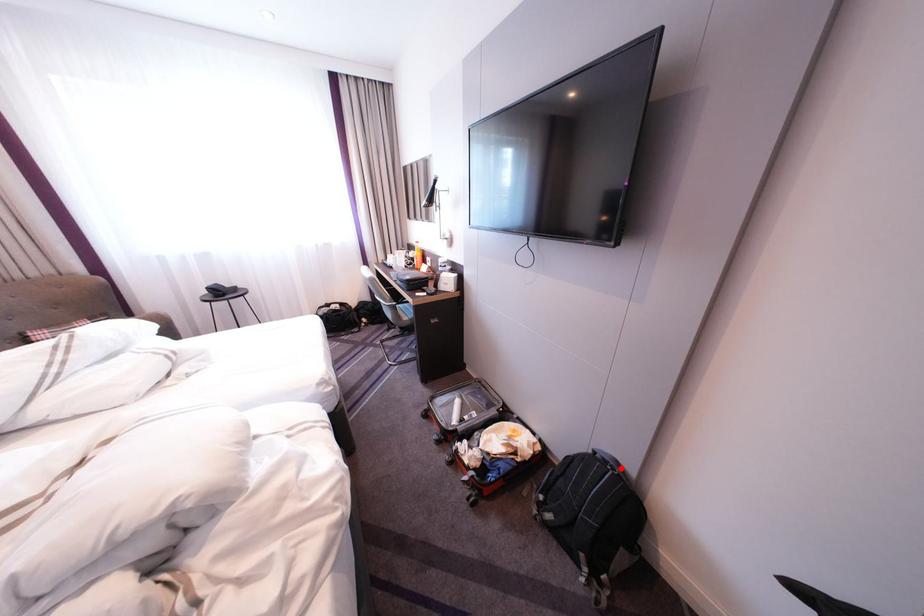
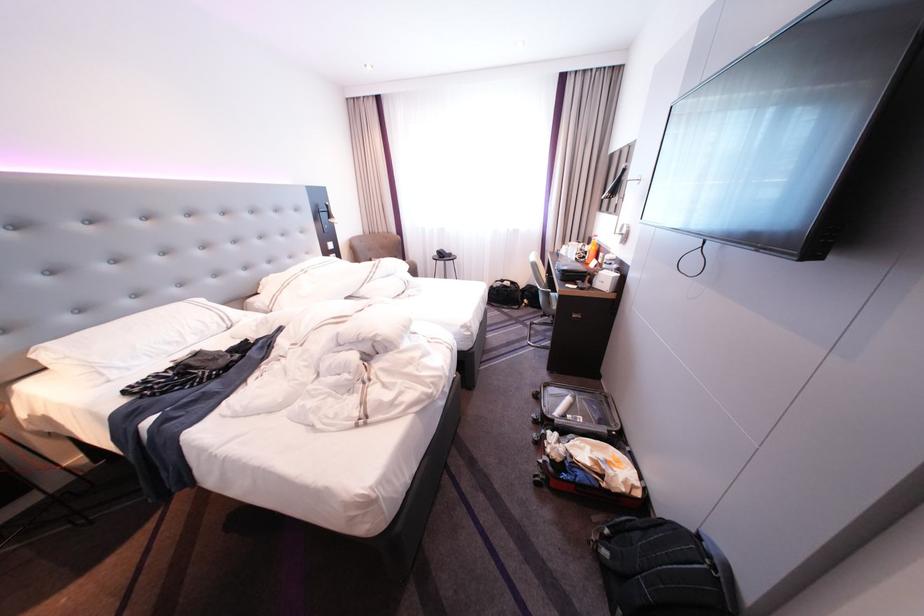
The point at the highlighted location is marked in the first image. Where is the corresponding point in the second image?

(720, 562)